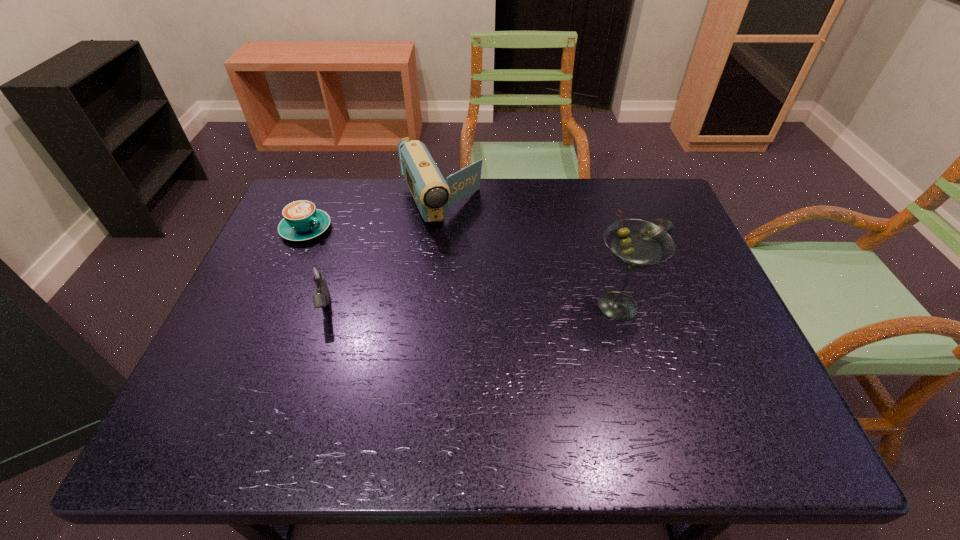
This screenshot has height=540, width=960. In order to click on the third closest object to the igniter in this screenshot , I will do `click(636, 244)`.

The width and height of the screenshot is (960, 540). Identify the location of the closest object relative to the leftmost object. (317, 273).

The height and width of the screenshot is (540, 960). Identify the location of vacant space that satisfies the following two spatial constraints: 1. on the back side of the martini; 2. on the right side of the igniter. (323, 306).